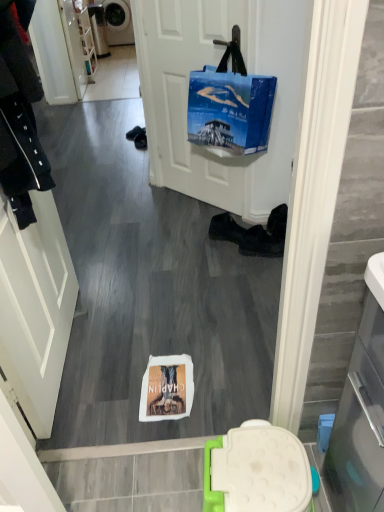
The height and width of the screenshot is (512, 384). I want to click on free spot to the left of black leather shoes at center, acting as the 2th footwear starting from the right, so click(188, 237).